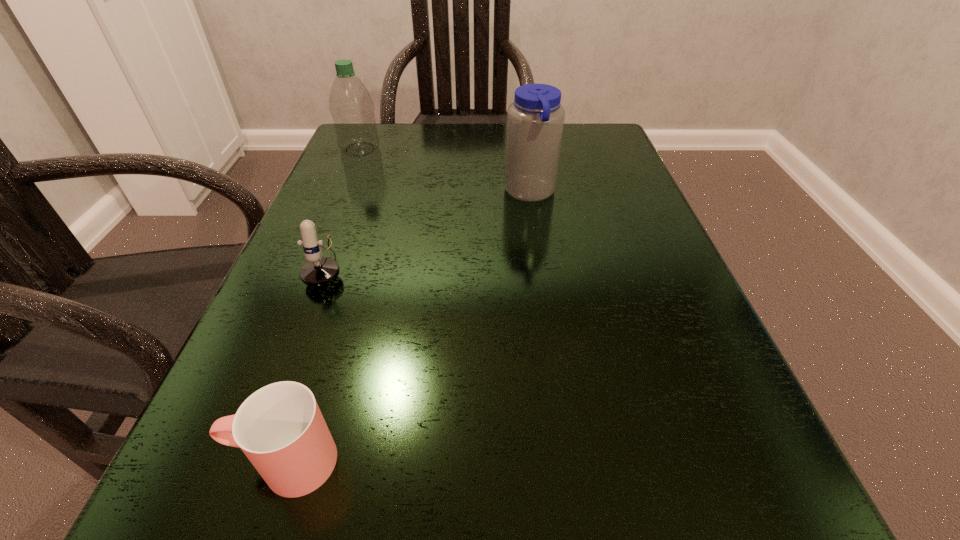
Locate an element on the screen. The width and height of the screenshot is (960, 540). the nearer water bottle is located at coordinates (535, 120).

Locate an element on the screen. This screenshot has width=960, height=540. the second farthest object is located at coordinates (535, 120).

Where is `the left water bottle`? This screenshot has width=960, height=540. the left water bottle is located at coordinates coord(351,106).

Locate an element on the screen. Image resolution: width=960 pixels, height=540 pixels. the farther water bottle is located at coordinates (351, 106).

Image resolution: width=960 pixels, height=540 pixels. I want to click on the third farthest object, so click(x=318, y=271).

I want to click on cup, so click(x=280, y=428).

Find the location of a particular element. free location located 0.080m with a carrying loop on the side of the right water bottle is located at coordinates (465, 193).

The height and width of the screenshot is (540, 960). In order to click on free spot located with a carrying loop on the side of the right water bottle in this screenshot , I will do 440,193.

This screenshot has height=540, width=960. Identify the location of vacant space situated 0.230m with a carrying loop on the side of the right water bottle. (390, 193).

Image resolution: width=960 pixels, height=540 pixels. I want to click on free space located 0.070m on the back of the farther water bottle, so click(370, 127).